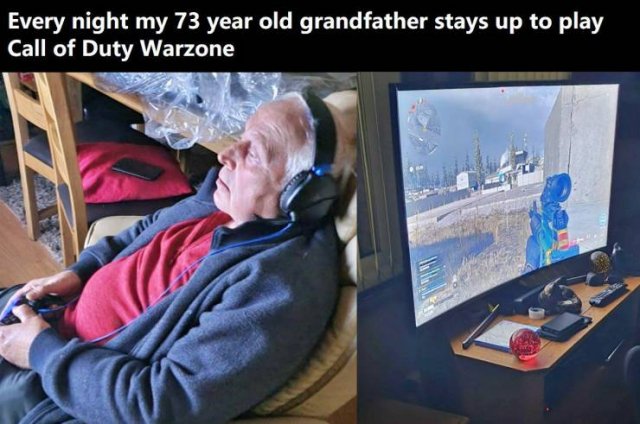
The height and width of the screenshot is (424, 640). Identify the location of tv. (472, 214).